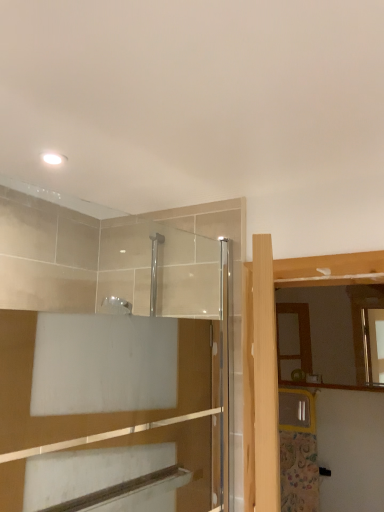
You are a GUI agent. You are given a task and a screenshot of the screen. Output one action in this format:
    pyautogui.click(x=<x>, y=<y>)
    Task: Click on the matte wooden mirror at right
    
    Given the screenshot: What is the action you would take?
    pyautogui.click(x=329, y=333)

What do you see at coordinates (329, 333) in the screenshot?
I see `matte wooden mirror at right` at bounding box center [329, 333].

Measure the distance between point (151, 219) and camera.

1.84 meters.

Locate an element on the screen. clear glass shower door at upper center is located at coordinates (213, 238).

Describe the element at coordinates (213, 238) in the screenshot. This screenshot has width=384, height=512. I see `clear glass shower door at upper center` at that location.

Locate an element on the screen. The image size is (384, 512). matte wooden mirror at right is located at coordinates (329, 333).

Considering the positions of objects clear glass shower door at upper center and matte wooden mirror at right in the image provided, who is more to the right, clear glass shower door at upper center or matte wooden mirror at right?

From the viewer's perspective, matte wooden mirror at right appears more on the right side.

In the image, is clear glass shower door at upper center positioned in front of or behind matte wooden mirror at right?

clear glass shower door at upper center is positioned closer to the viewer than matte wooden mirror at right.

Is point (238, 328) farther from camera compared to point (349, 309)?

That is False.

From the image's perspective, which one is positioned lower, clear glass shower door at upper center or matte wooden mirror at right?

matte wooden mirror at right.

From a real-world perspective, is clear glass shower door at upper center beneath matte wooden mirror at right?

Yes, from a real-world perspective, clear glass shower door at upper center is below matte wooden mirror at right.

In the scene shown: Is clear glass shower door at upper center wider or thinner than matte wooden mirror at right?

Clearly, clear glass shower door at upper center has less width compared to matte wooden mirror at right.

Is clear glass shower door at upper center shorter than matte wooden mirror at right?

No, clear glass shower door at upper center is not shorter than matte wooden mirror at right.

Who is smaller, clear glass shower door at upper center or matte wooden mirror at right?

matte wooden mirror at right is smaller.

Is clear glass shower door at upper center positioned beyond the bounds of matte wooden mirror at right?

Indeed, clear glass shower door at upper center is completely outside matte wooden mirror at right.

Is clear glass shower door at upper center in contact with matte wooden mirror at right?

No, clear glass shower door at upper center is not beside matte wooden mirror at right.

Could you tell me if clear glass shower door at upper center is facing matte wooden mirror at right?

No, clear glass shower door at upper center is not facing towards matte wooden mirror at right.

What's the angular difference between clear glass shower door at upper center and matte wooden mirror at right's facing directions?

The angular difference between clear glass shower door at upper center and matte wooden mirror at right is 81.4 degrees.

Find the location of a particular element. The image size is (384, 512). screen door lying on the left of matte wooden mirror at right is located at coordinates (213, 238).

Considering the relative positions of matte wooden mirror at right and clear glass shower door at upper center in the image provided, is matte wooden mirror at right to the right of clear glass shower door at upper center from the viewer's perspective?

Indeed, matte wooden mirror at right is positioned on the right side of clear glass shower door at upper center.

Does matte wooden mirror at right lie in front of clear glass shower door at upper center?

No, it is not.

Which is further, (305, 300) or (238, 308)?

The point (305, 300) is farther from the camera.

From the image's perspective, is matte wooden mirror at right above or below clear glass shower door at upper center?

Based on their image positions, matte wooden mirror at right is located beneath clear glass shower door at upper center.

From a real-world perspective, is matte wooden mirror at right above or below clear glass shower door at upper center?

From a real-world perspective, matte wooden mirror at right is physically above clear glass shower door at upper center.

Which object is wider, matte wooden mirror at right or clear glass shower door at upper center?

With larger width is matte wooden mirror at right.

Is matte wooden mirror at right taller than clear glass shower door at upper center?

Incorrect, the height of matte wooden mirror at right is not larger of that of clear glass shower door at upper center.

Between matte wooden mirror at right and clear glass shower door at upper center, which one has larger size?

clear glass shower door at upper center is bigger.

Can clear glass shower door at upper center be found inside matte wooden mirror at right?

Definitely not — clear glass shower door at upper center is not inside matte wooden mirror at right.

Are matte wooden mirror at right and clear glass shower door at upper center far apart?

Indeed, matte wooden mirror at right is not near clear glass shower door at upper center.

Is matte wooden mirror at right oriented towards clear glass shower door at upper center?

Yes, matte wooden mirror at right faces towards clear glass shower door at upper center.

What's the angular difference between matte wooden mirror at right and clear glass shower door at upper center's facing directions?

They differ by 81.4 degrees in their facing directions.

You are a GUI agent. You are given a task and a screenshot of the screen. Output one action in this format:
    pyautogui.click(x=<x>, y=<y>)
    Task: Click on the mirror on the right of the clear glass shower door at upper center
    
    Given the screenshot: What is the action you would take?
    pyautogui.click(x=329, y=333)

Where is `screen door in front of the matte wooden mirror at right`? The width and height of the screenshot is (384, 512). screen door in front of the matte wooden mirror at right is located at coordinates (213, 238).

You are a GUI agent. You are given a task and a screenshot of the screen. Output one action in this format:
    pyautogui.click(x=<x>, y=<y>)
    Task: Click on the mirror on the right of clear glass shower door at upper center
    
    Given the screenshot: What is the action you would take?
    pyautogui.click(x=329, y=333)